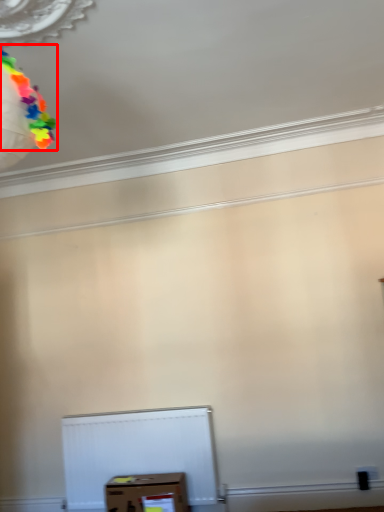
Question: From the image's perspective, where is balloon (annotated by the red box) located in relation to box in the image?

Choices:
 (A) above
 (B) below

Answer: (A)